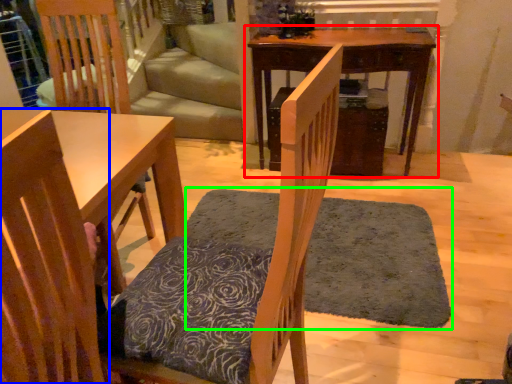
Question: Which object is positioned farthest from table (highlighted by a red box)? Select from chair (highlighted by a blue box) and doormat (highlighted by a green box).

Choices:
 (A) chair
 (B) doormat

Answer: (A)